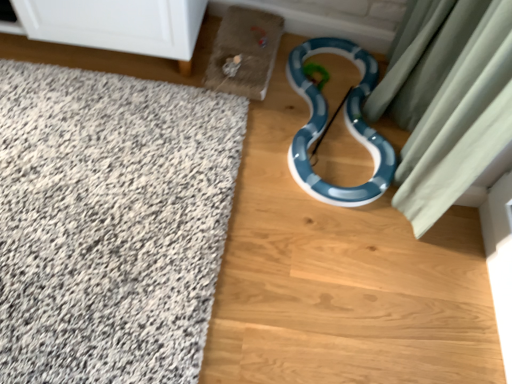
This screenshot has height=384, width=512. I want to click on vacant space that is in between blue glossy snake at center and white shaggy bath mat at left, so click(x=234, y=208).